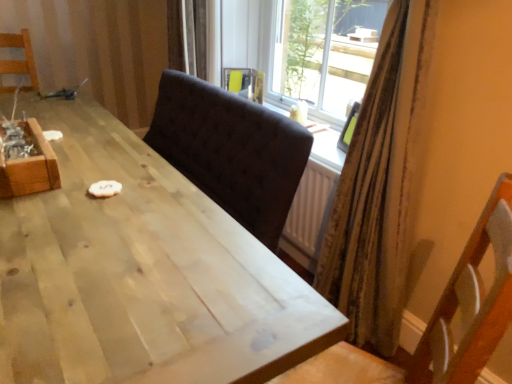
Where is `vacant area that is situated to the right of wooden crate at left`? vacant area that is situated to the right of wooden crate at left is located at coordinates (103, 174).